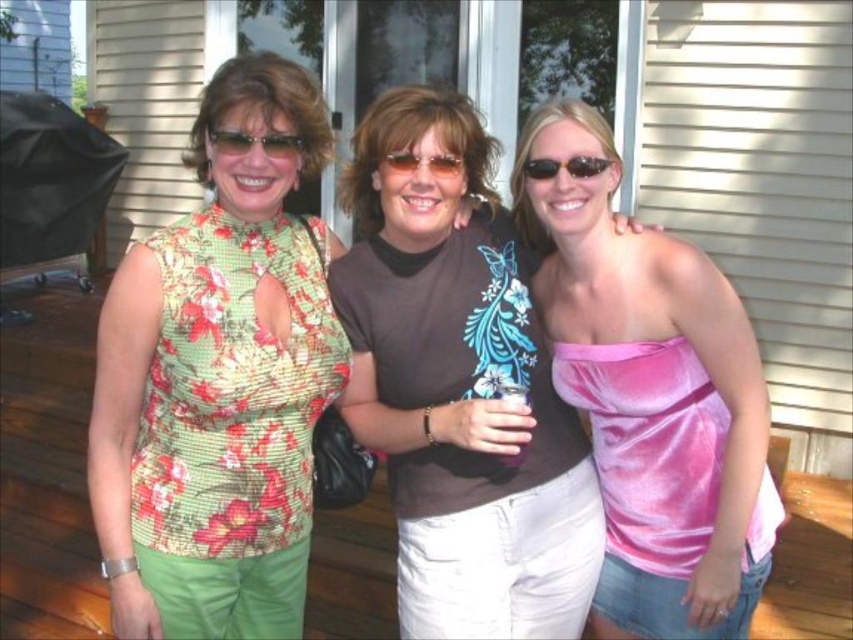
Is pink satin tank top at center wider than sunglasses at center?

Yes, pink satin tank top at center is wider than sunglasses at center.

Who is lower down, pink satin tank top at center or sunglasses at center?

pink satin tank top at center is lower down.

Where is `pink satin tank top at center`? pink satin tank top at center is located at coordinates (653, 397).

Image resolution: width=853 pixels, height=640 pixels. In order to click on pink satin tank top at center in this screenshot , I will do `click(653, 397)`.

Can you confirm if sunglasses at center is smaller than matte plastic sunglasses at center?

Actually, sunglasses at center might be larger than matte plastic sunglasses at center.

Does sunglasses at center lie behind matte plastic sunglasses at center?

No.

Does point (230, 131) lie behind point (461, 168)?

No, it is in front of (461, 168).

You are a GUI agent. You are given a task and a screenshot of the screen. Output one action in this format:
    pyautogui.click(x=<x>, y=<y>)
    Task: Click on the sunglasses at center
    
    Given the screenshot: What is the action you would take?
    pyautogui.click(x=256, y=141)

Which is below, brown cotton t-shirt at center or black plastic sunglasses at center?

Positioned lower is brown cotton t-shirt at center.

From the picture: Which is more to the left, brown cotton t-shirt at center or black plastic sunglasses at center?

brown cotton t-shirt at center is more to the left.

Image resolution: width=853 pixels, height=640 pixels. What do you see at coordinates (459, 388) in the screenshot?
I see `brown cotton t-shirt at center` at bounding box center [459, 388].

Locate an element on the screen. brown cotton t-shirt at center is located at coordinates (459, 388).